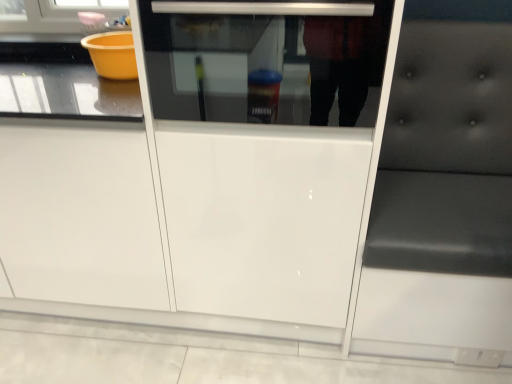
Question: Considering the positions of point tap(501, 362) and point tap(368, 62), is point tap(501, 362) closer or farther from the camera than point tap(368, 62)?

Choices:
 (A) closer
 (B) farther

Answer: (B)

Question: Which is correct: black leather cushion at right is inside transparent glass oven at center, or outside of it?

Choices:
 (A) inside
 (B) outside

Answer: (B)

Question: Is black leather cushion at right in front of or behind transparent glass oven at center in the image?

Choices:
 (A) behind
 (B) front

Answer: (B)

Question: From the image's perspective, is transparent glass oven at center located above or below black leather cushion at right?

Choices:
 (A) above
 (B) below

Answer: (A)

Question: Is point (305, 3) positioned closer to the camera than point (416, 238)?

Choices:
 (A) farther
 (B) closer

Answer: (B)

Question: From a real-world perspective, is transparent glass oven at center physically located above or below black leather cushion at right?

Choices:
 (A) above
 (B) below

Answer: (A)

Question: Is transparent glass oven at center bigger or smaller than black leather cushion at right?

Choices:
 (A) small
 (B) big

Answer: (A)